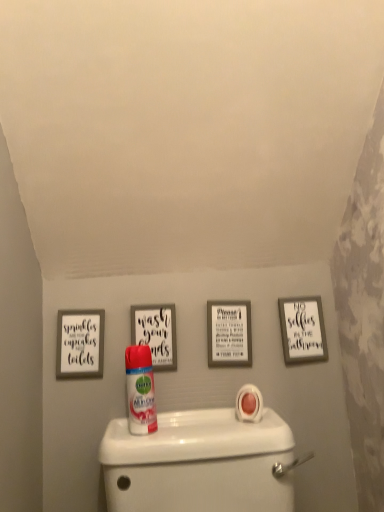
At what (x,y) coordinates should I click in order to perform the action: click on vacant area to the right of white plastic can at center. Please return your answer as a coordinate pair (x, y). Image resolution: width=384 pixels, height=512 pixels. Looking at the image, I should click on (212, 431).